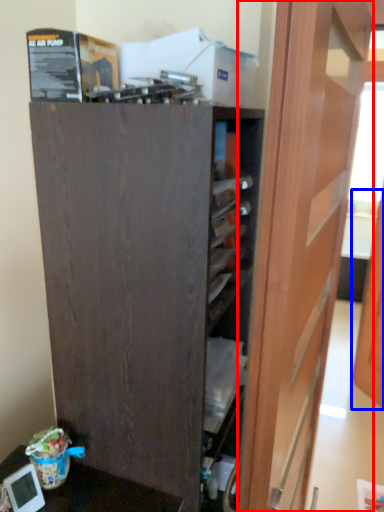
Question: Among these objects, which one is farthest to the camera, door (highlighted by a red box) or door (highlighted by a blue box)?

Choices:
 (A) door
 (B) door

Answer: (B)